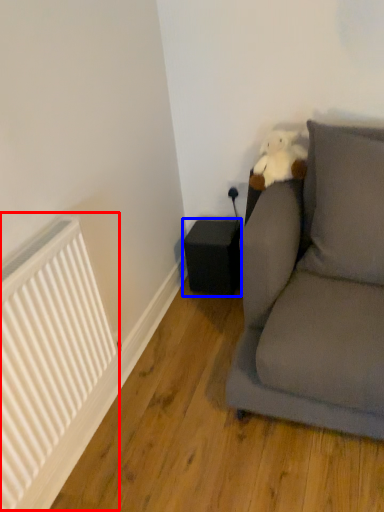
Question: Which object appears farthest to the camera in this image, radiator (highlighted by a red box) or speaker (highlighted by a blue box)?

Choices:
 (A) radiator
 (B) speaker

Answer: (B)